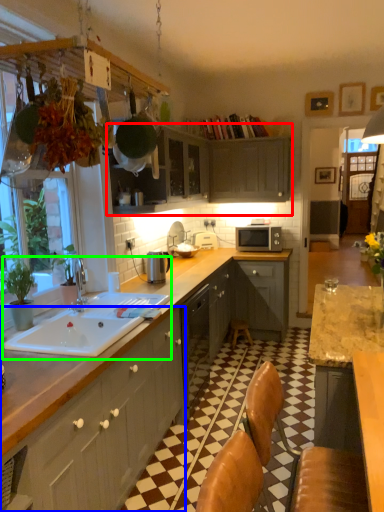
Question: Which is nearer to the cabinetry (highlighted by a red box)? cabinetry (highlighted by a blue box) or sink (highlighted by a green box).

Choices:
 (A) cabinetry
 (B) sink

Answer: (B)